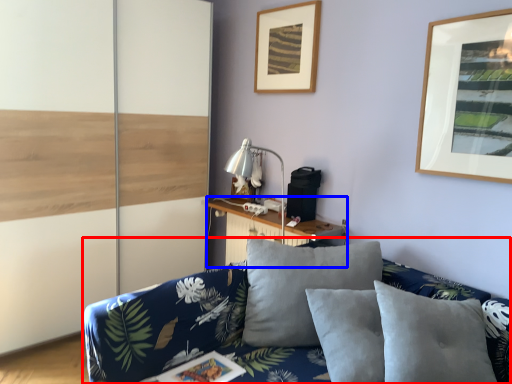
Question: Among these objects, which one is farthest to the camera, studio couch (highlighted by a red box) or table (highlighted by a blue box)?

Choices:
 (A) studio couch
 (B) table

Answer: (B)